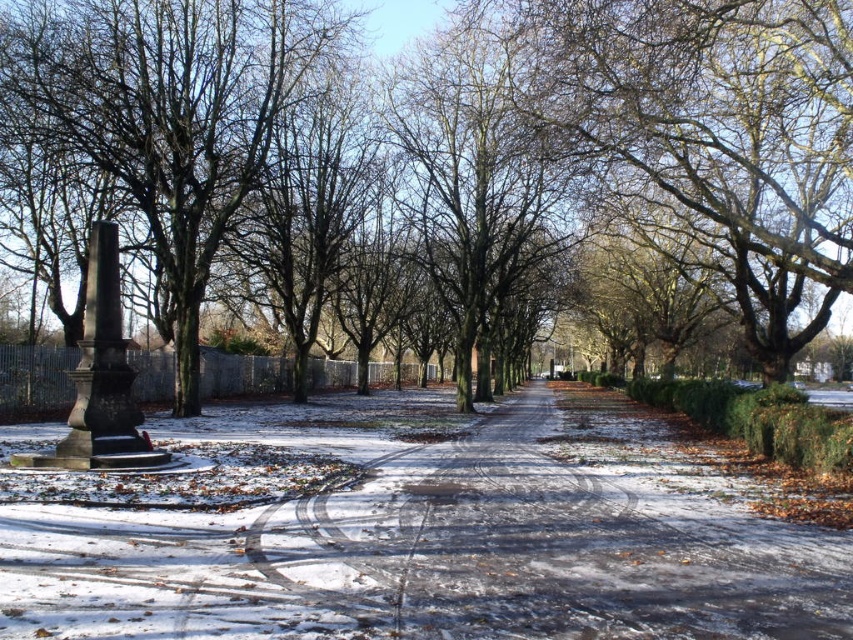
Question: Based on their relative distances, which object is farther from the bare branches at center?

Choices:
 (A) brown textured tree at center
 (B) smooth brown tree at left
 (C) snowy asphalt path at lower left

Answer: (B)

Question: Is smooth brown tree at left to the right of brown textured tree at center from the viewer's perspective?

Choices:
 (A) no
 (B) yes

Answer: (A)

Question: Which object is closer to the camera taking this photo?

Choices:
 (A) smooth brown tree at left
 (B) bare branches at center
 (C) snowy asphalt path at lower left

Answer: (C)

Question: Which point is farther to the camera?

Choices:
 (A) smooth brown tree at left
 (B) brown textured tree at center
 (C) bare branches at center
 (D) snowy asphalt path at lower left

Answer: (A)

Question: Does snowy asphalt path at lower left appear over bare branches at center?

Choices:
 (A) yes
 (B) no

Answer: (B)

Question: Is bare branches at center to the right of smooth brown tree at left from the viewer's perspective?

Choices:
 (A) yes
 (B) no

Answer: (A)